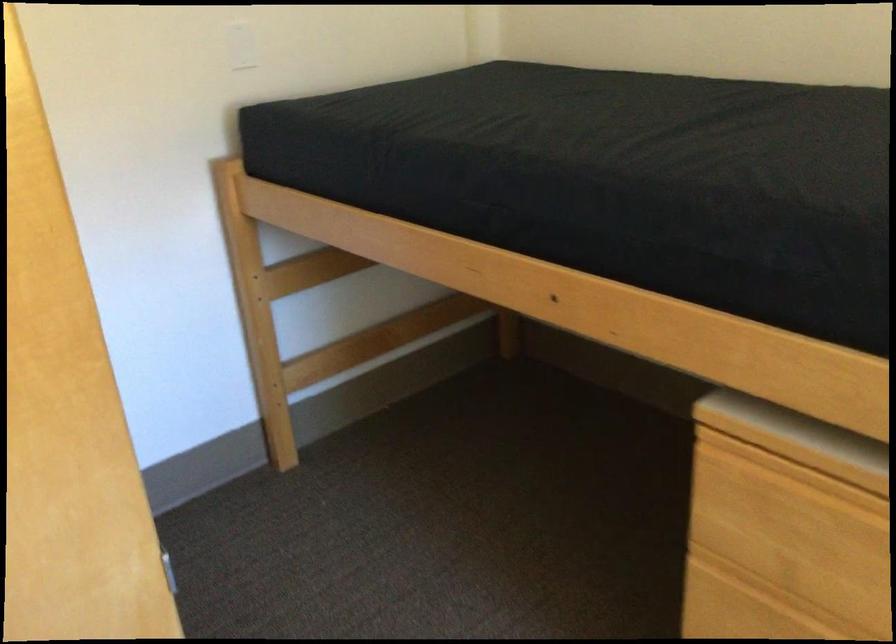
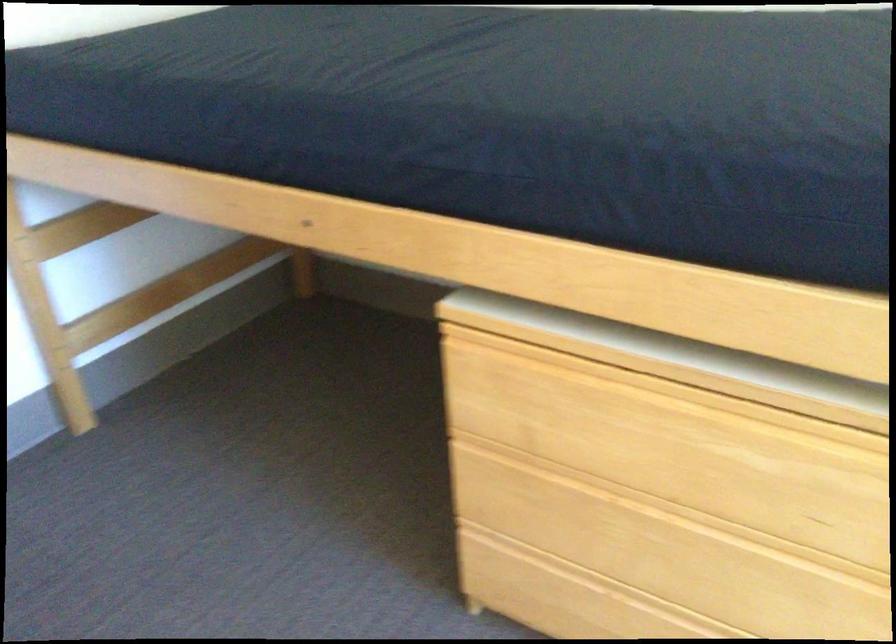
What movement of the cameraman would produce the second image?

The cameraman walked toward right, backward.